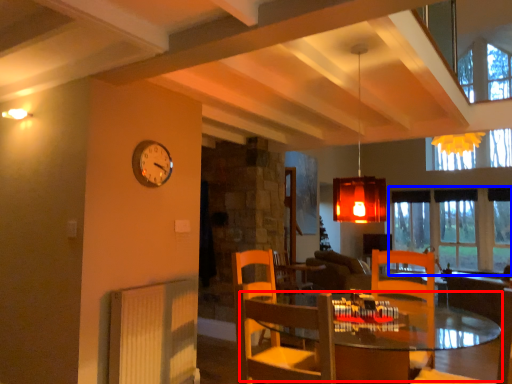
Question: Which point is further to the camera, table (highlighted by a red box) or window (highlighted by a blue box)?

Choices:
 (A) table
 (B) window

Answer: (B)